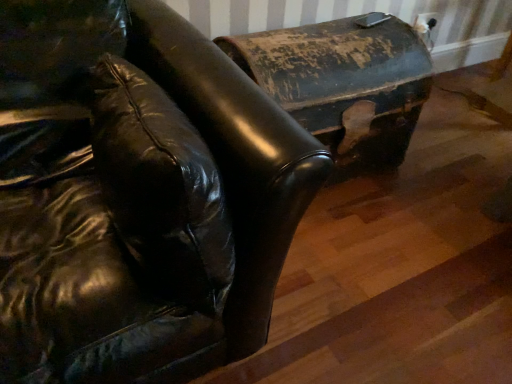
Describe the element at coordinates (344, 83) in the screenshot. Image resolution: width=512 pixels, height=384 pixels. I see `rusty metal trunk at upper right, acting as the 1th furniture starting from the right` at that location.

This screenshot has width=512, height=384. Find the location of `rusty metal trunk at upper right, arranged as the second furniture when viewed from the left`. rusty metal trunk at upper right, arranged as the second furniture when viewed from the left is located at coordinates (344, 83).

In order to face rusty metal trunk at upper right, acting as the 1th furniture starting from the right, should I rotate leftwards or rightwards?

A 9.263 degree turn to the right will do.

At what (x,y) coordinates should I click in order to perform the action: click on shiny black leather couch at center, which is the second furniture from right to left. Please return your answer as a coordinate pair (x, y). Looking at the image, I should click on (137, 195).

Describe the element at coordinates (137, 195) in the screenshot. I see `shiny black leather couch at center, which is the second furniture from right to left` at that location.

What is the approximate width of shiny black leather couch at center, which is the second furniture from right to left?

The width of shiny black leather couch at center, which is the second furniture from right to left, is 3.81 feet.

What are the coordinates of `rusty metal trunk at upper right, arranged as the second furniture when viewed from the left` in the screenshot? It's located at (344, 83).

Does shiny black leather couch at center, which is the second furniture from right to left, appear on the left side of rusty metal trunk at upper right, arranged as the second furniture when viewed from the left?

Correct, you'll find shiny black leather couch at center, which is the second furniture from right to left, to the left of rusty metal trunk at upper right, arranged as the second furniture when viewed from the left.

Considering the positions of objects shiny black leather couch at center, which is the second furniture from right to left, and rusty metal trunk at upper right, acting as the 1th furniture starting from the right, in the image provided, who is in front, shiny black leather couch at center, which is the second furniture from right to left, or rusty metal trunk at upper right, acting as the 1th furniture starting from the right,?

shiny black leather couch at center, which is the second furniture from right to left, is more forward.

Between point (95, 351) and point (421, 45), which one is positioned in front?

The point (95, 351) is closer to the camera.

From the image's perspective, is shiny black leather couch at center, which is the second furniture from right to left, below rusty metal trunk at upper right, arranged as the second furniture when viewed from the left?

Correct, shiny black leather couch at center, which is the second furniture from right to left, appears lower than rusty metal trunk at upper right, arranged as the second furniture when viewed from the left, in the image.

From a real-world perspective, which object stands above the other?

shiny black leather couch at center, which is the second furniture from right to left.

Which object is wider, shiny black leather couch at center, which is the second furniture from right to left, or rusty metal trunk at upper right, arranged as the second furniture when viewed from the left?

shiny black leather couch at center, which is the second furniture from right to left.

From their relative heights in the image, would you say shiny black leather couch at center, which is the second furniture from right to left, is taller or shorter than rusty metal trunk at upper right, arranged as the second furniture when viewed from the left?

shiny black leather couch at center, which is the second furniture from right to left, is taller than rusty metal trunk at upper right, arranged as the second furniture when viewed from the left.

Which of these two, shiny black leather couch at center, marked as the 1th furniture in a left-to-right arrangement, or rusty metal trunk at upper right, acting as the 1th furniture starting from the right, is bigger?

Bigger between the two is shiny black leather couch at center, marked as the 1th furniture in a left-to-right arrangement.

Is shiny black leather couch at center, which is the second furniture from right to left, spatially inside rusty metal trunk at upper right, acting as the 1th furniture starting from the right, or outside of it?

shiny black leather couch at center, which is the second furniture from right to left, is not inside rusty metal trunk at upper right, acting as the 1th furniture starting from the right, it's outside.

Would you say shiny black leather couch at center, which is the second furniture from right to left, is a long distance from rusty metal trunk at upper right, arranged as the second furniture when viewed from the left?

shiny black leather couch at center, which is the second furniture from right to left, is actually quite close to rusty metal trunk at upper right, arranged as the second furniture when viewed from the left.

Based on the photo, is shiny black leather couch at center, which is the second furniture from right to left, facing away from rusty metal trunk at upper right, acting as the 1th furniture starting from the right?

That's not correct — shiny black leather couch at center, which is the second furniture from right to left, is not looking away from rusty metal trunk at upper right, acting as the 1th furniture starting from the right.

Can you tell me how much shiny black leather couch at center, which is the second furniture from right to left, and rusty metal trunk at upper right, acting as the 1th furniture starting from the right, differ in facing direction?

The angle between the facing direction of shiny black leather couch at center, which is the second furniture from right to left, and the facing direction of rusty metal trunk at upper right, acting as the 1th furniture starting from the right, is 1.64 degrees.

In order to click on furniture below the rusty metal trunk at upper right, arranged as the second furniture when viewed from the left (from the image's perspective) in this screenshot , I will do `click(137, 195)`.

Between rusty metal trunk at upper right, acting as the 1th furniture starting from the right, and shiny black leather couch at center, which is the second furniture from right to left, which one appears on the right side from the viewer's perspective?

Positioned to the right is rusty metal trunk at upper right, acting as the 1th furniture starting from the right.

In the scene shown: Which object is further away from the camera, rusty metal trunk at upper right, acting as the 1th furniture starting from the right, or shiny black leather couch at center, marked as the 1th furniture in a left-to-right arrangement?

rusty metal trunk at upper right, acting as the 1th furniture starting from the right, is behind.

Considering the points (364, 74) and (121, 18), which point is behind, point (364, 74) or point (121, 18)?

The point (364, 74) is behind.

From the picture: From the image's perspective, relative to shiny black leather couch at center, which is the second furniture from right to left, is rusty metal trunk at upper right, arranged as the second furniture when viewed from the left, above or below?

Clearly, from the image's perspective, rusty metal trunk at upper right, arranged as the second furniture when viewed from the left, is above shiny black leather couch at center, which is the second furniture from right to left.

From a real-world perspective, is rusty metal trunk at upper right, acting as the 1th furniture starting from the right, above or below shiny black leather couch at center, marked as the 1th furniture in a left-to-right arrangement?

Clearly, from a real-world perspective, rusty metal trunk at upper right, acting as the 1th furniture starting from the right, is below shiny black leather couch at center, marked as the 1th furniture in a left-to-right arrangement.

Is rusty metal trunk at upper right, arranged as the second furniture when viewed from the left, wider or thinner than shiny black leather couch at center, marked as the 1th furniture in a left-to-right arrangement?

In the image, rusty metal trunk at upper right, arranged as the second furniture when viewed from the left, appears to be more narrow than shiny black leather couch at center, marked as the 1th furniture in a left-to-right arrangement.

Consider the image. Considering the sizes of rusty metal trunk at upper right, arranged as the second furniture when viewed from the left, and shiny black leather couch at center, marked as the 1th furniture in a left-to-right arrangement, in the image, is rusty metal trunk at upper right, arranged as the second furniture when viewed from the left, taller or shorter than shiny black leather couch at center, marked as the 1th furniture in a left-to-right arrangement,?

In the image, rusty metal trunk at upper right, arranged as the second furniture when viewed from the left, appears to be shorter than shiny black leather couch at center, marked as the 1th furniture in a left-to-right arrangement.

Which of these two, rusty metal trunk at upper right, acting as the 1th furniture starting from the right, or shiny black leather couch at center, which is the second furniture from right to left, is bigger?

Bigger between the two is shiny black leather couch at center, which is the second furniture from right to left.

Is shiny black leather couch at center, marked as the 1th furniture in a left-to-right arrangement, completely or partially inside rusty metal trunk at upper right, arranged as the second furniture when viewed from the left?

No, shiny black leather couch at center, marked as the 1th furniture in a left-to-right arrangement, is not a part of rusty metal trunk at upper right, arranged as the second furniture when viewed from the left.

Can you see rusty metal trunk at upper right, acting as the 1th furniture starting from the right, touching shiny black leather couch at center, marked as the 1th furniture in a left-to-right arrangement?

No.

Looking at this image, could you tell me if rusty metal trunk at upper right, arranged as the second furniture when viewed from the left, is facing shiny black leather couch at center, which is the second furniture from right to left?

No, rusty metal trunk at upper right, arranged as the second furniture when viewed from the left, is not aimed at shiny black leather couch at center, which is the second furniture from right to left.

How many degrees apart are the facing directions of rusty metal trunk at upper right, arranged as the second furniture when viewed from the left, and shiny black leather couch at center, marked as the 1th furniture in a left-to-right arrangement?

1.64 degrees separate the facing orientations of rusty metal trunk at upper right, arranged as the second furniture when viewed from the left, and shiny black leather couch at center, marked as the 1th furniture in a left-to-right arrangement.

You are a GUI agent. You are given a task and a screenshot of the screen. Output one action in this format:
    pyautogui.click(x=<x>, y=<y>)
    Task: Click on the furniture in front of the rusty metal trunk at upper right, arranged as the second furniture when viewed from the left
    Image resolution: width=512 pixels, height=384 pixels.
    Given the screenshot: What is the action you would take?
    pyautogui.click(x=137, y=195)

I want to click on furniture on the left side of rusty metal trunk at upper right, acting as the 1th furniture starting from the right, so click(137, 195).

Locate an element on the screen. This screenshot has height=384, width=512. furniture above the rusty metal trunk at upper right, acting as the 1th furniture starting from the right (from a real-world perspective) is located at coordinates (137, 195).